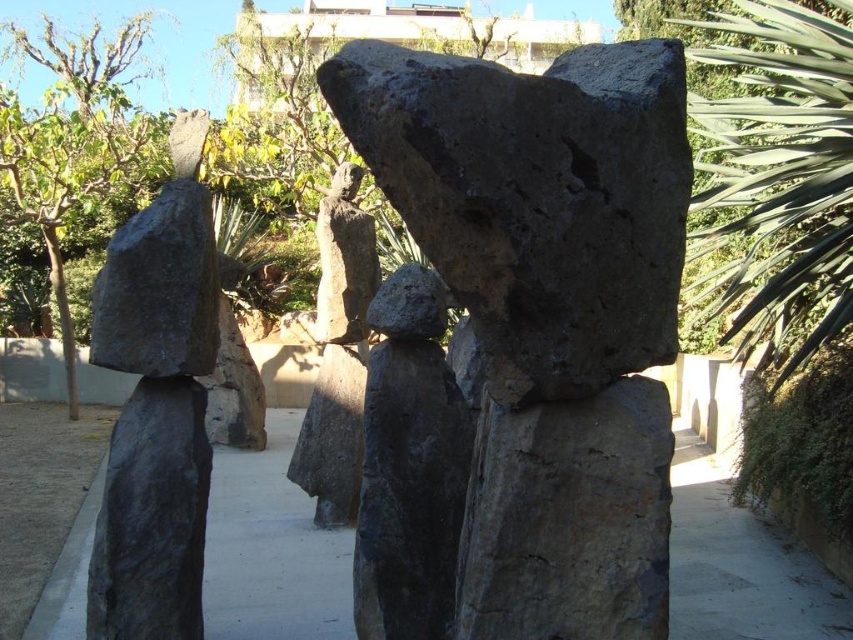
You are a gardener planning to place a new decorative fountain in the garden. The fountain requires a base that is wider than the dark gray stone boulder at left. Can the dark gray stone path at center provide a suitable base for the fountain?

The dark gray stone path at center is wider than the dark gray stone boulder at left, so it can provide a suitable base for the fountain since its width meets the requirement.

You are standing at the camera position and want to reach point (532, 168). Is the distance less than 5 feet?

The distance between point (532, 168) and the camera is 4.93 feet, which is less than 5 feet.